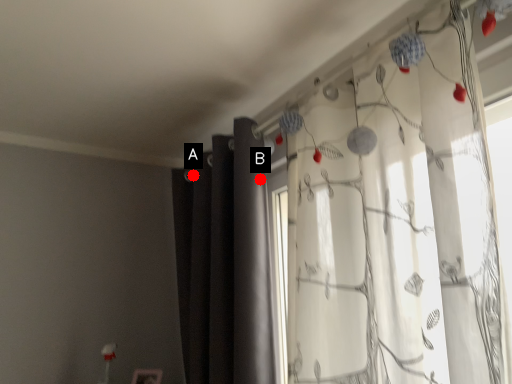
Question: Two points are circled on the image, labeled by A and B beside each circle. Which point is farther from the camera taking this photo?

Choices:
 (A) A is further
 (B) B is further

Answer: (A)